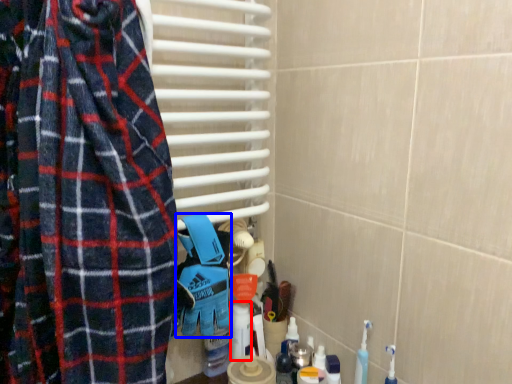
Question: Among these objects, which one is nearest to the camera, cleaning product (highlighted by a red box) or blanket (highlighted by a blue box)?

Choices:
 (A) cleaning product
 (B) blanket

Answer: (B)